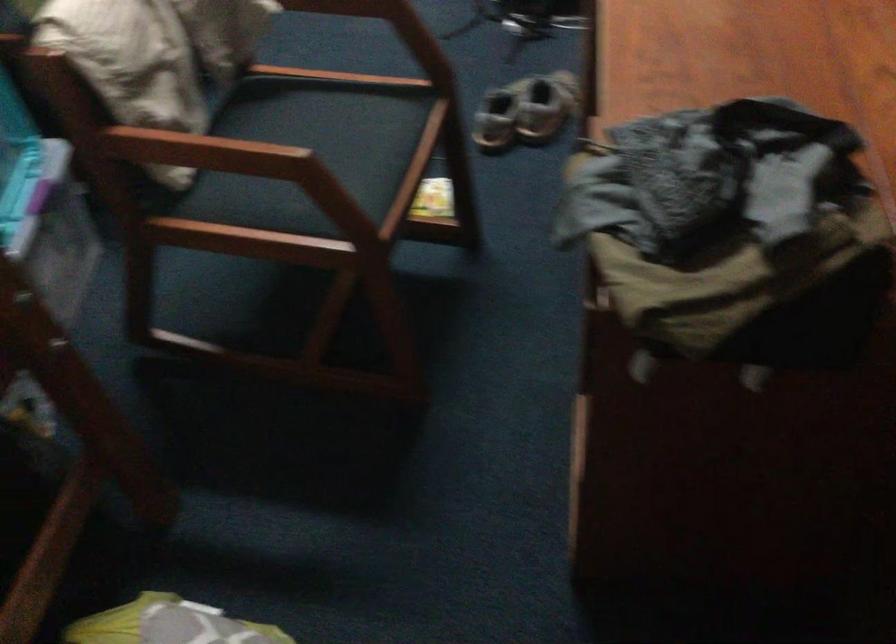
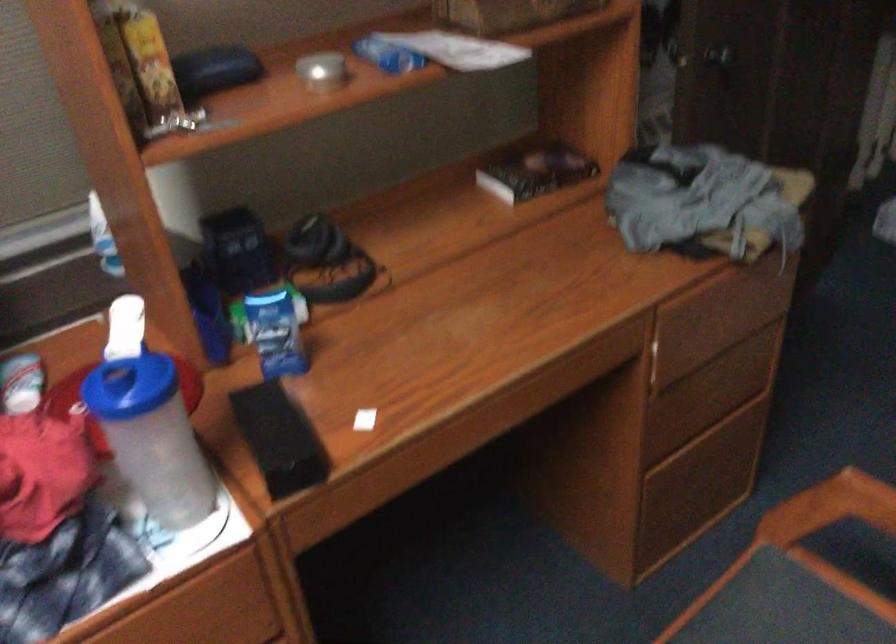
Find the pixel in the second image that matches point 376,196 in the first image.

(830, 507)